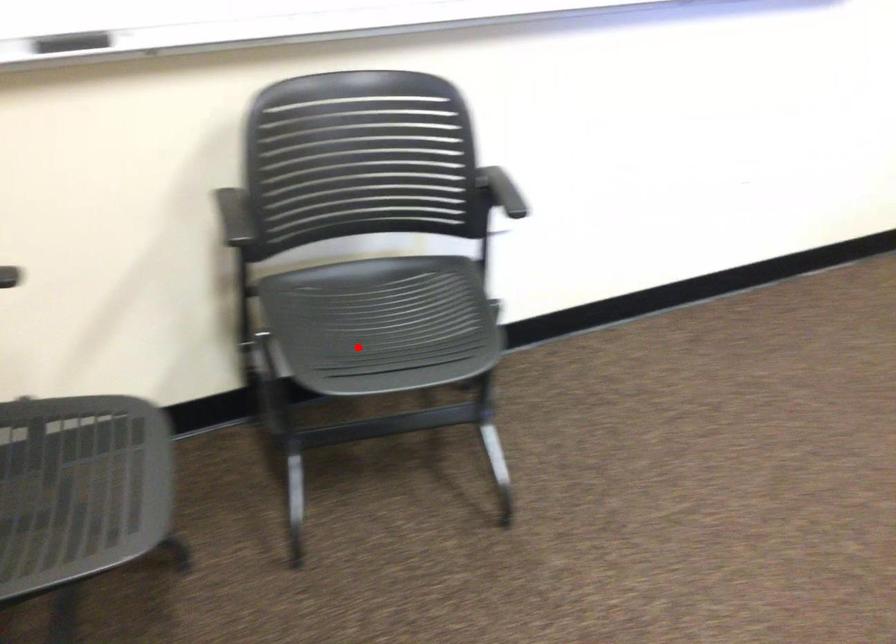
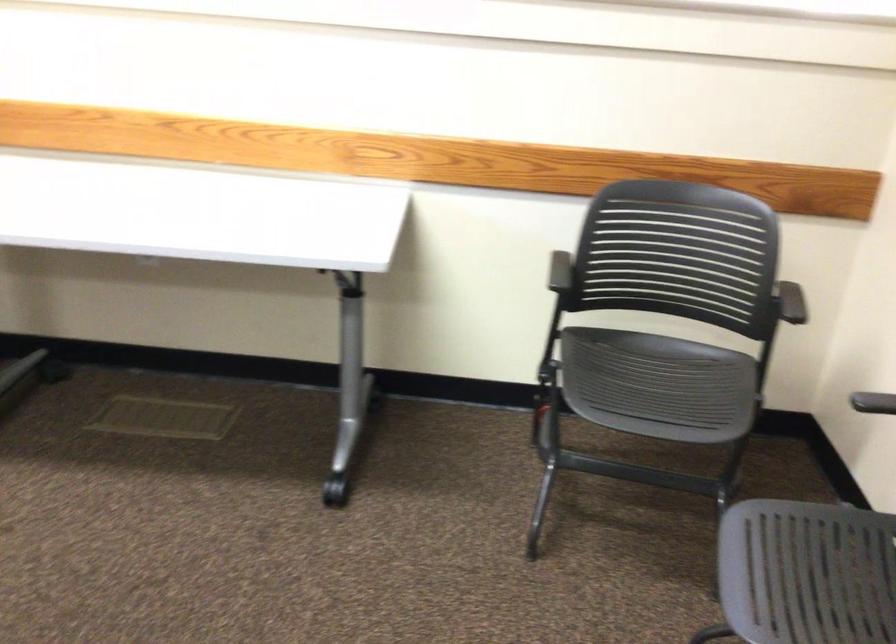
In the second image, find the point that corresponds to the highlighted location in the first image.

(806, 573)